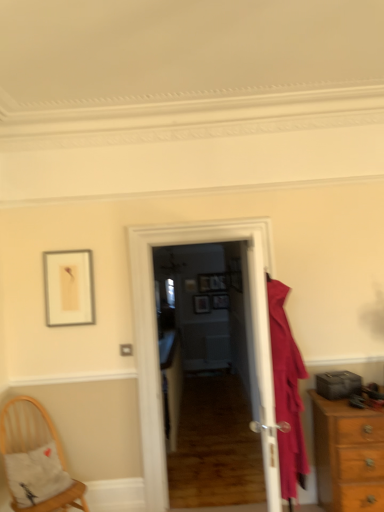
Question: Is point (203, 297) positioned closer to the camera than point (223, 303)?

Choices:
 (A) farther
 (B) closer

Answer: (A)

Question: Considering the positions of matte wooden picture frame at center, the second picture frame in the left-to-right sequence, and matte wooden picture frame at center, which is the first picture frame from right to left, in the image, is matte wooden picture frame at center, the second picture frame in the left-to-right sequence, wider or thinner than matte wooden picture frame at center, which is the first picture frame from right to left,?

Choices:
 (A) thin
 (B) wide

Answer: (A)

Question: Which of these objects is positioned closest to the white glossy door at center, placed as the first door when sorted from back to front?

Choices:
 (A) matte gold picture frame at center, which is the first picture frame in left-to-right order
 (B) light brown wooden chest of drawers at right
 (C) woven wood chair at lower left
 (D) matte pink coat at right
 (E) matte wooden picture frame at center, the second picture frame in the left-to-right sequence

Answer: (D)

Question: Which object is positioned closest to the matte gold picture frame at center, which is the first picture frame in left-to-right order?

Choices:
 (A) white glossy door at center, positioned as the 2th door in back-to-front order
 (B) white glossy door at center, which is counted as the 2th door, starting from the front
 (C) matte wooden picture frame at center, which is the first picture frame from right to left
 (D) woven wood chair at lower left
 (E) matte wooden picture frame at center, the second picture frame in the left-to-right sequence

Answer: (E)